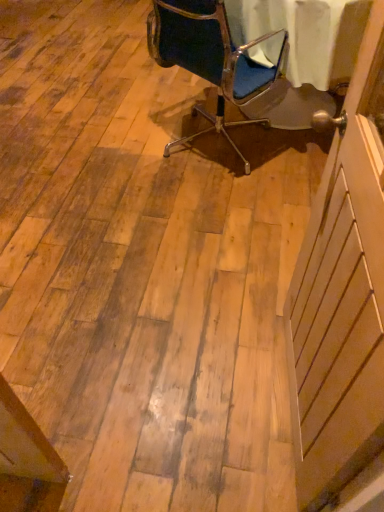
Locate an element on the screen. The image size is (384, 512). free point behind white wood screen door at right is located at coordinates (233, 288).